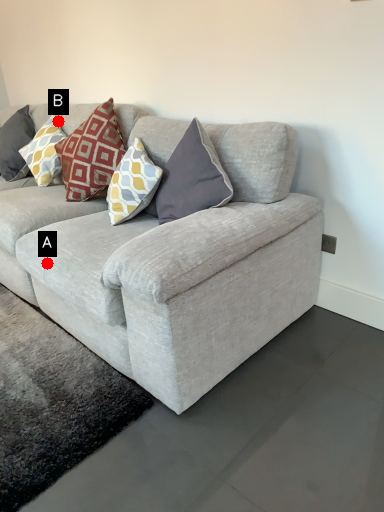
Question: Two points are circled on the image, labeled by A and B beside each circle. Which point is further to the camera?

Choices:
 (A) A is further
 (B) B is further

Answer: (B)